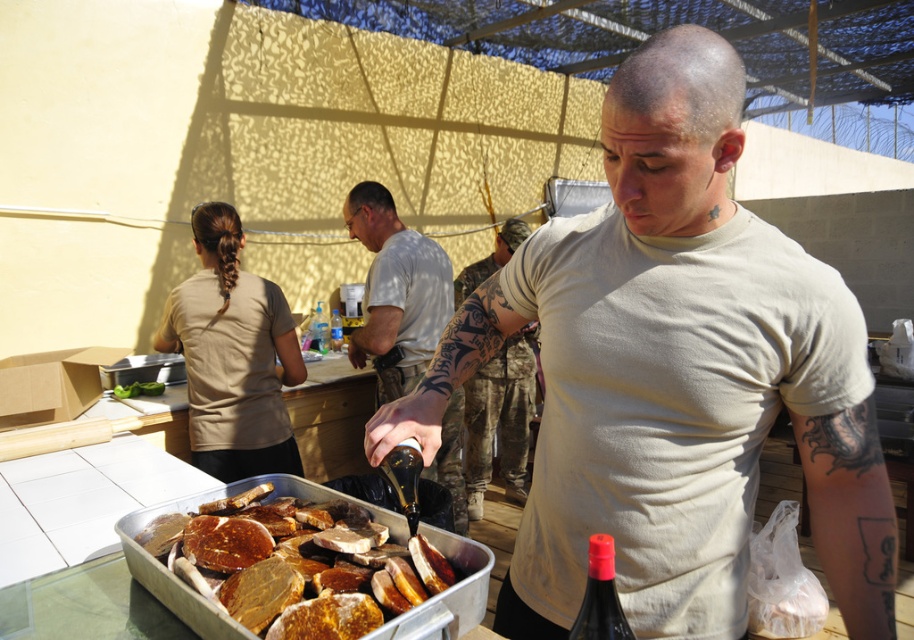
Does brown matte meat at center appear under dark brown glass bottle at lower center?

Indeed, brown matte meat at center is positioned under dark brown glass bottle at lower center.

Does brown matte meat at center appear on the left side of dark brown glass bottle at lower center?

Yes, brown matte meat at center is to the left of dark brown glass bottle at lower center.

Where is `brown matte meat at center`? The width and height of the screenshot is (914, 640). brown matte meat at center is located at coordinates (204, 596).

Where is `brown matte meat at center`? The height and width of the screenshot is (640, 914). brown matte meat at center is located at coordinates (204, 596).

Which is more to the right, matte khaki t-shirt at center or translucent plastic bottle at center?

matte khaki t-shirt at center

Can you confirm if matte khaki t-shirt at center is positioned above translucent plastic bottle at center?

No.

Does point (633, 252) come in front of point (336, 332)?

Yes, point (633, 252) is closer to viewer.

The width and height of the screenshot is (914, 640). I want to click on matte khaki t-shirt at center, so (x=673, y=376).

Does dark brown glass bottle at lower center appear on the right side of translucent plastic bottle at center?

Correct, you'll find dark brown glass bottle at lower center to the right of translucent plastic bottle at center.

Does dark brown glass bottle at lower center have a greater height compared to translucent plastic bottle at center?

No.

Is point (626, 632) more distant than point (339, 333)?

No.

This screenshot has height=640, width=914. In order to click on dark brown glass bottle at lower center in this screenshot , I will do `click(600, 596)`.